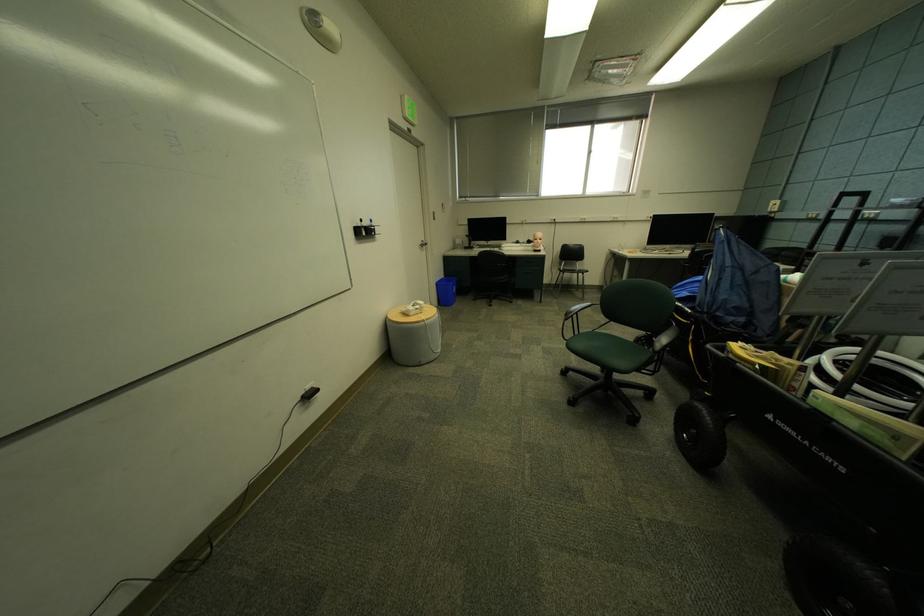
Identify the location of black chair sitting surface. The image size is (924, 616). (609, 351).